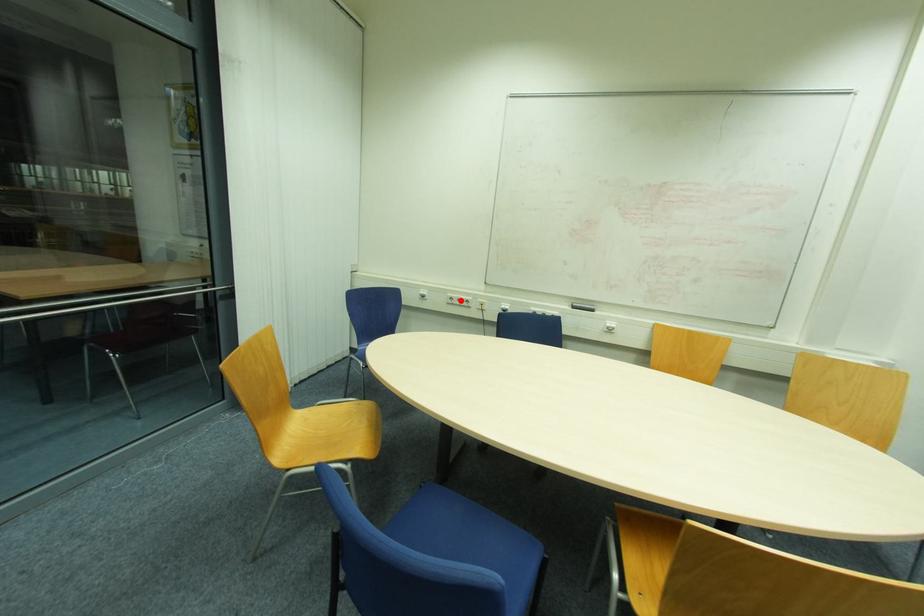
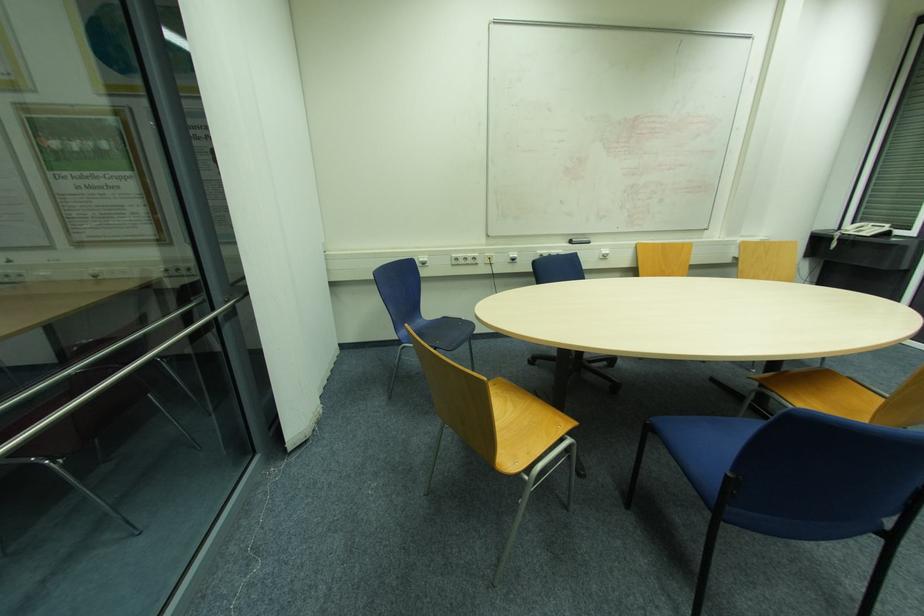
Question: I am providing you with two images of the same scene from different viewpoints. A red point is marked on the first image. At the location where the point appears in image 1, is it still visible in image 2?

Choices:
 (A) Yes
 (B) No

Answer: (A)